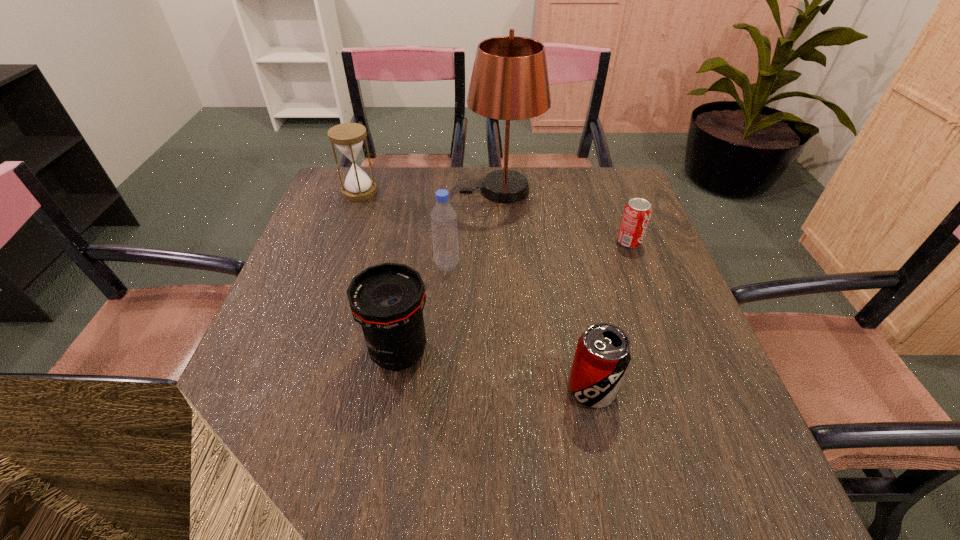
Where is `free space between the lampshade and the shortest object`? This screenshot has width=960, height=540. free space between the lampshade and the shortest object is located at coordinates (564, 215).

This screenshot has width=960, height=540. I want to click on free space between the lampshade and the bottle, so click(x=474, y=227).

You are a GUI agent. You are given a task and a screenshot of the screen. Output one action in this format:
    pyautogui.click(x=<x>, y=<y>)
    Task: Click on the third closest object relative to the lampshade
    Image resolution: width=960 pixels, height=540 pixels.
    Given the screenshot: What is the action you would take?
    pyautogui.click(x=348, y=137)

Identify which object is the second nearest to the tallest object. Please provide its 2D coordinates. Your answer should be formatted as a tuple, i.e. [(x, y)], where the tuple contains the x and y coordinates of a point satisfying the conditions above.

[(637, 212)]

Where is `vacant point that satisfies the following two spatial constraints: 1. on the front side of the hourglass; 2. on the left side of the taller soda can`? vacant point that satisfies the following two spatial constraints: 1. on the front side of the hourglass; 2. on the left side of the taller soda can is located at coordinates (291, 388).

This screenshot has height=540, width=960. In order to click on free region that satisfies the following two spatial constraints: 1. on the front-facing side of the right soda can; 2. on the right side of the tallest object in this screenshot , I will do `click(504, 241)`.